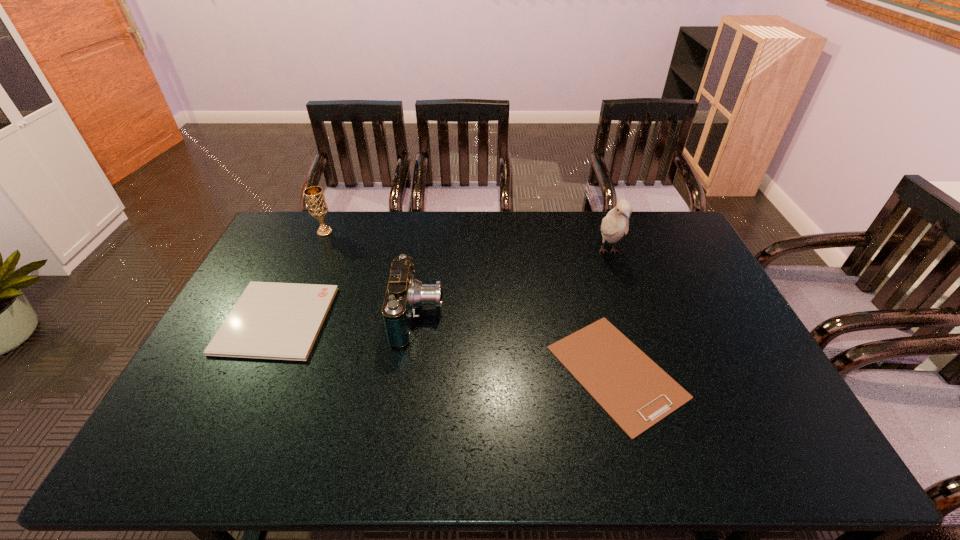
I want to click on vacant area at the near edge, so click(525, 440).

This screenshot has width=960, height=540. I want to click on vacant region at the left edge, so click(278, 254).

In the image, there is a desktop. Where is `vacant space at the right edge`? The width and height of the screenshot is (960, 540). vacant space at the right edge is located at coordinates (736, 392).

Locate an element on the screen. The width and height of the screenshot is (960, 540). unoccupied area between the camcorder and the tallest object is located at coordinates (514, 284).

Identify the location of free space that is in between the third object from right to left and the tallest object. This screenshot has height=540, width=960. (514, 284).

This screenshot has height=540, width=960. I want to click on unoccupied area between the third object from right to left and the shortest object, so click(x=517, y=344).

Where is `empty space that is in between the chalice and the third object from left to right`? empty space that is in between the chalice and the third object from left to right is located at coordinates (372, 274).

At what (x,y) coordinates should I click in order to perform the action: click on unoccupied area between the shortest object and the fourth tallest object. Please return your answer as a coordinate pair (x, y). The image size is (960, 540). Looking at the image, I should click on (446, 346).

At what (x,y) coordinates should I click in order to perform the action: click on free space between the bird and the shorter clipboard. Please return your answer as a coordinate pair (x, y). The height and width of the screenshot is (540, 960). Looking at the image, I should click on (612, 312).

Where is `free spot between the third object from left to right and the bird`? The image size is (960, 540). free spot between the third object from left to right and the bird is located at coordinates (514, 284).